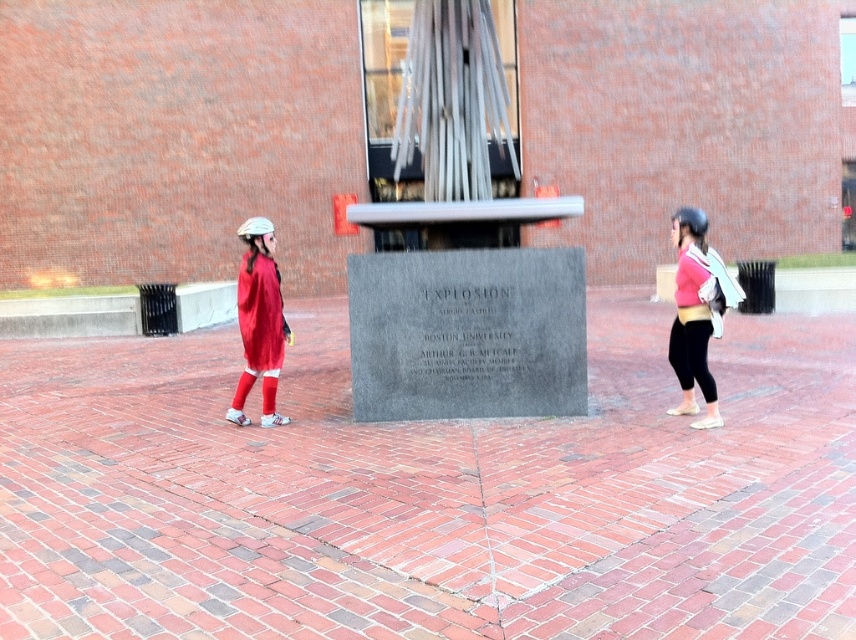
You are a delivery person who needs to place a package between the matte red sweater at left and the pink fabric backpack at right. The package requires a minimum of 12 feet of space to be safely placed. Can you determine if there is enough space between them for the package?

The distance between the matte red sweater at left and the pink fabric backpack at right is 14.47 feet, which exceeds the required 12 feet. Therefore, there is enough space to safely place the package between them.

You are standing in the plaza and want to pick up the pink fabric backpack at right. However, you notice the matte red sweater at left is in the way. Can you reach the backpack without moving the sweater?

The pink fabric backpack at right is behind the matte red sweater at left, so you cannot reach it without moving the sweater.

You are standing at the center of the square and see the point marked at coordinates (259,321). What object is located at that point?

The point at coordinates (259,321) marks the matte red sweater at left.